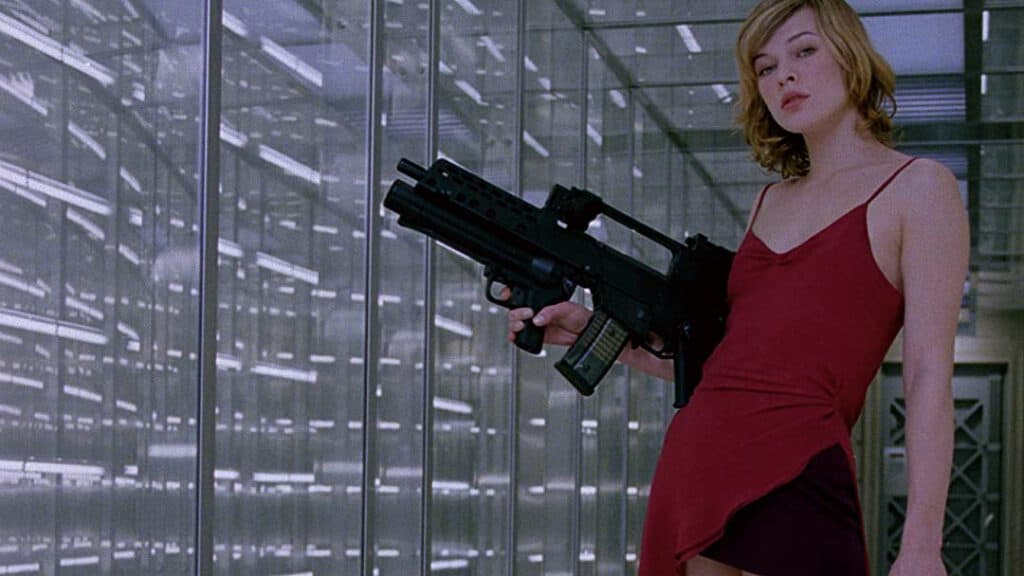
This screenshot has width=1024, height=576. I want to click on glass, so click(304, 347).